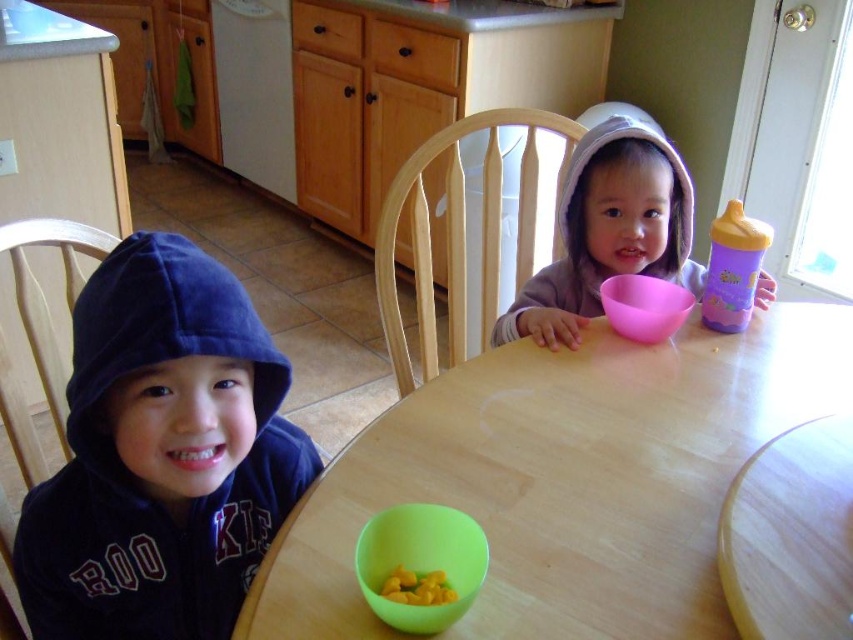
Question: Which object is positioned closest to the velvet blue hoodie at left?

Choices:
 (A) green plastic bowl at lower center
 (B) pink matte bowl at center
 (C) natural wood chair at center

Answer: (A)

Question: Does wooden table at center have a smaller size compared to green plastic bowl at lower center?

Choices:
 (A) yes
 (B) no

Answer: (B)

Question: Where is pink plastic bowl at center located in relation to green plastic bowl at lower center in the image?

Choices:
 (A) right
 (B) left

Answer: (A)

Question: Which object appears closest to the camera in this image?

Choices:
 (A) pink matte bowl at center
 (B) pink plastic bowl at center

Answer: (A)

Question: Among these objects, which one is nearest to the camera?

Choices:
 (A) green plastic bowl at lower center
 (B) velvet blue hoodie at left
 (C) wooden chair at left
 (D) pink matte bowl at center

Answer: (B)

Question: Does pink matte bowl at center appear on the left side of yellow matte/yellowish matte/yellowish matte/yellowish matte/yellowish matte/yellowish matte/yellowish matte/yellowish matte/yellowish matte/yellowish matte/yellowish matte/yellowish matte/yellowish matte/yellowish matte/yellowish matte/yellowish matte/yellowish matte/yellowish matte/yellowish matte/yellowish matte/yellowish matte/yellowish matte/yellowish matte/yellowish matte/yellowish matte/yellowish matte/yellowish matte/yellowish matte/yellowish matte/yellowish matte/yellowish matte/yellowish matte/yellow?

Choices:
 (A) yes
 (B) no

Answer: (B)